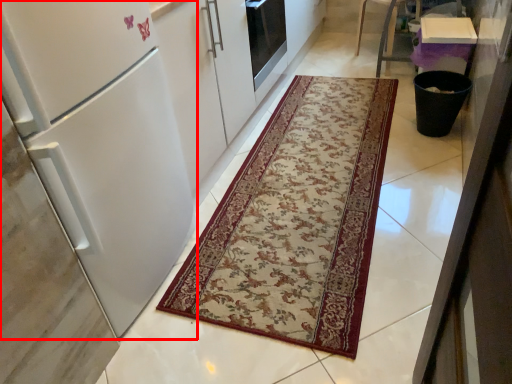
Question: From the image's perspective, what is the correct spatial positioning of refrigerator (annotated by the red box) in reference to mat?

Choices:
 (A) above
 (B) below

Answer: (B)